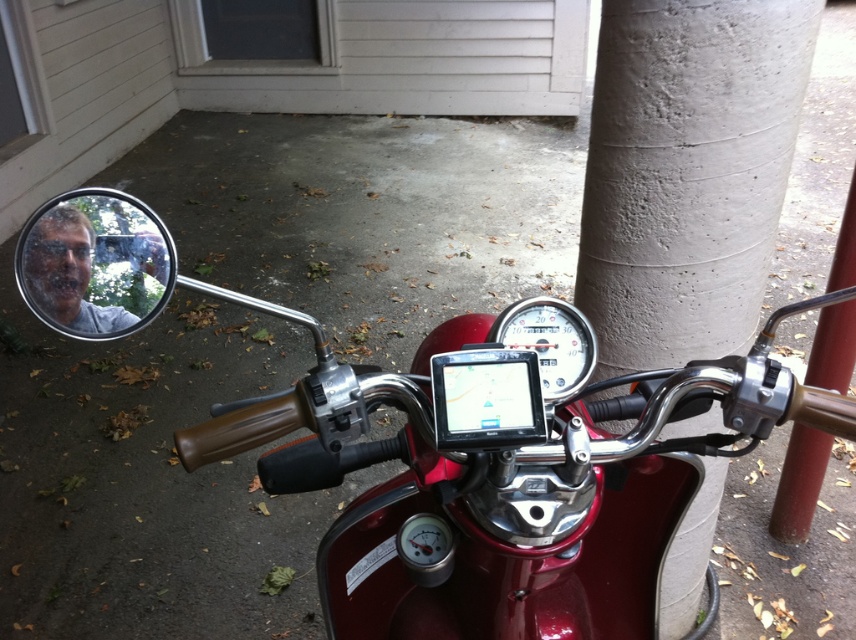
Is point (572, 396) behind point (847, 204)?

That is False.

Who is taller, glossy red motorcycle at center or red metal pole at right?

Standing taller between the two is red metal pole at right.

This screenshot has height=640, width=856. Describe the element at coordinates (450, 442) in the screenshot. I see `glossy red motorcycle at center` at that location.

This screenshot has height=640, width=856. I want to click on glossy red motorcycle at center, so click(450, 442).

Between glossy red motorcycle at center and concrete at center, which one has more height?

Standing taller between the two is concrete at center.

Looking at this image, can you confirm if glossy red motorcycle at center is positioned to the right of concrete at center?

In fact, glossy red motorcycle at center is to the left of concrete at center.

Which is behind, point (599, 568) or point (758, 230)?

Point (758, 230)

The image size is (856, 640). Find the location of `glossy red motorcycle at center`. glossy red motorcycle at center is located at coordinates (450, 442).

How far apart are concrete at center and red metal pole at right?

A distance of 18.89 inches exists between concrete at center and red metal pole at right.

Consider the image. Is concrete at center below red metal pole at right?

No.

Between point (688, 348) and point (819, 380), which one is positioned in front?

Point (688, 348) is more forward.

Locate an element on the screen. The height and width of the screenshot is (640, 856). concrete at center is located at coordinates (687, 172).